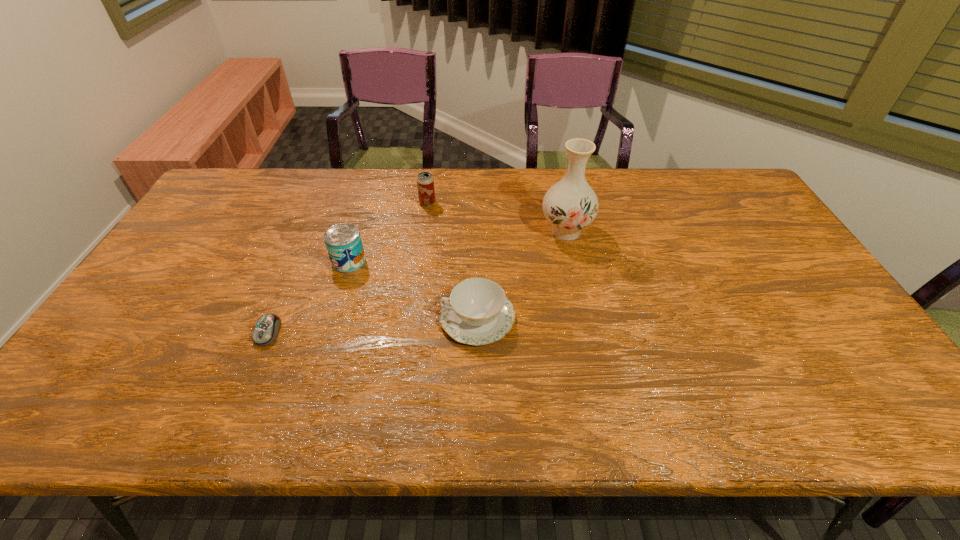
At what (x,y) coordinates should I click in order to perform the action: click on free space located on the left of the tallest object. Please return your answer as a coordinate pair (x, y). Looking at the image, I should click on (482, 231).

The height and width of the screenshot is (540, 960). I want to click on free space located 0.330m on the left of the farthest object, so click(321, 202).

Where is `vacant space located on the right of the fourth object from right to left`? Image resolution: width=960 pixels, height=540 pixels. vacant space located on the right of the fourth object from right to left is located at coordinates (418, 261).

At what (x,y) coordinates should I click in order to perform the action: click on free space located 0.110m on the handle side of the fourth tallest object. Please return your answer as a coordinate pair (x, y). This screenshot has height=540, width=960. Looking at the image, I should click on (396, 318).

Locate an element on the screen. The height and width of the screenshot is (540, 960). vacant space located on the handle side of the fourth tallest object is located at coordinates (350, 318).

Locate an element on the screen. The image size is (960, 540). vacant space situated on the handle side of the fourth tallest object is located at coordinates (377, 318).

Locate an element on the screen. The height and width of the screenshot is (540, 960). vacant point located 0.050m on the wheel side of the leftmost object is located at coordinates (254, 365).

The image size is (960, 540). Find the location of `object that is at the far edge`. object that is at the far edge is located at coordinates (425, 183).

The image size is (960, 540). In the image, there is a desktop. Identify the location of free region at the far edge. (672, 199).

Locate an element on the screen. The width and height of the screenshot is (960, 540). free space at the near edge is located at coordinates (805, 417).